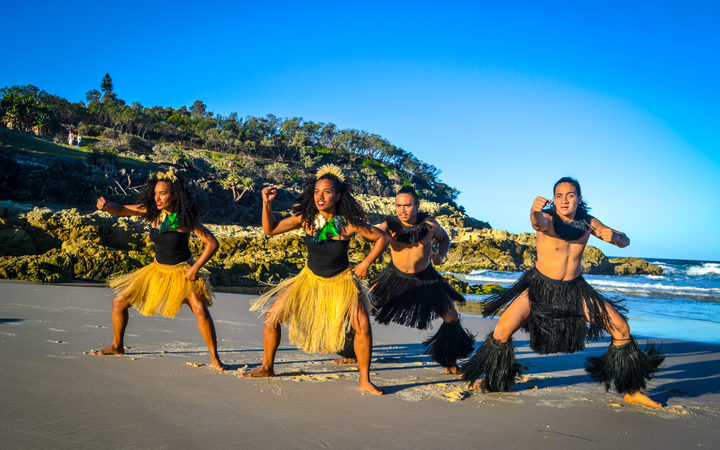
Where is `chest`? chest is located at coordinates (567, 244), (413, 247).